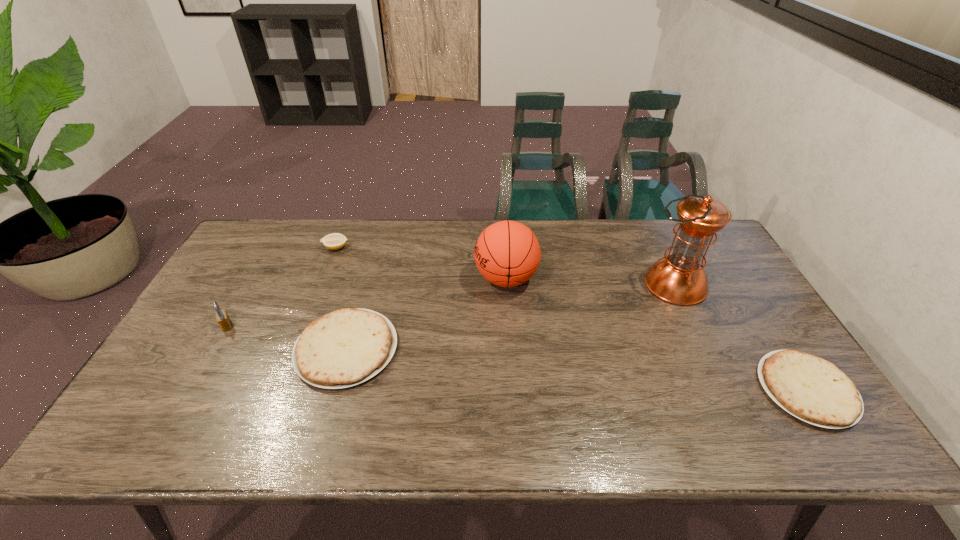
Find the location of a particular element. Image resolution: width=960 pixels, height=540 pixels. vacant space located on the back of the right tortilla is located at coordinates (741, 288).

Image resolution: width=960 pixels, height=540 pixels. What are the coordinates of `free spot located on the front of the farthest object` in the screenshot? It's located at (304, 332).

This screenshot has height=540, width=960. Identify the location of blank space located on the right of the tallest object. (722, 285).

I want to click on vacant area situated on the right of the fourth shortest object, so click(x=301, y=326).

Locate an element on the screen. vacant space located on the side with logo of the basketball is located at coordinates (378, 279).

Locate an element on the screen. The width and height of the screenshot is (960, 540). vacant space located on the side with logo of the basketball is located at coordinates (414, 279).

At what (x,y) coordinates should I click in order to perform the action: click on vacant space situated on the side with logo of the basketball. Please return your answer as a coordinate pair (x, y). This screenshot has height=540, width=960. Looking at the image, I should click on (378, 279).

You are a GUI agent. You are given a task and a screenshot of the screen. Output one action in this format:
    pyautogui.click(x=<x>, y=<y>)
    Task: Click on the lemon located in the far edge section of the desktop
    This screenshot has width=960, height=540.
    Given the screenshot: What is the action you would take?
    pyautogui.click(x=334, y=241)

What are the coordinates of `basketball located in the far edge section of the desktop` in the screenshot? It's located at (507, 253).

At what (x,y) coordinates should I click in order to perform the action: click on object that is at the left edge. Please return your answer as a coordinate pair (x, y). Looking at the image, I should click on (222, 317).